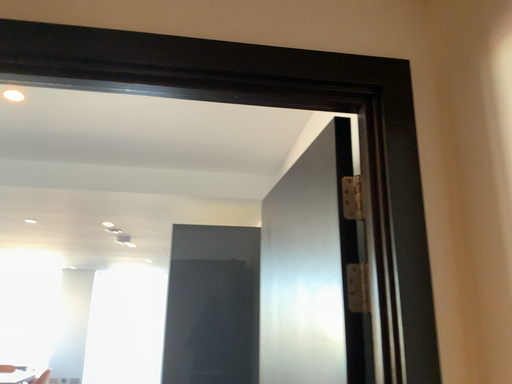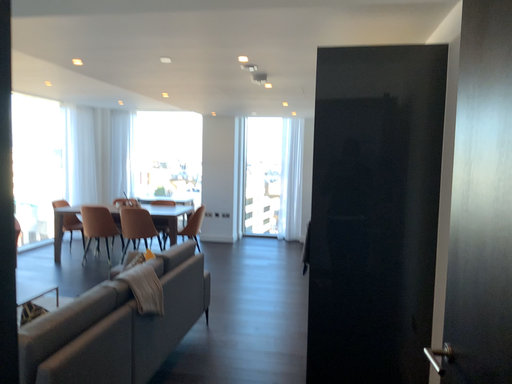
Question: How did the camera likely rotate when shooting the video?

Choices:
 (A) rotated downward
 (B) rotated upward

Answer: (A)